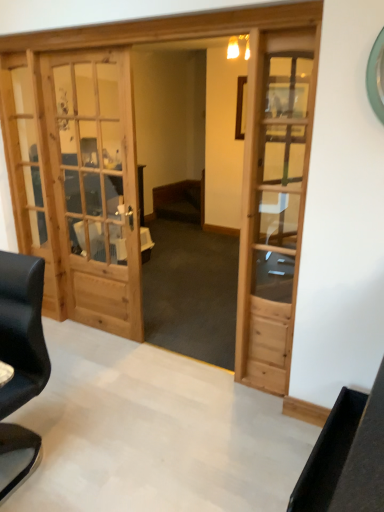
What do you see at coordinates (273, 202) in the screenshot? I see `light brown wooden door at center` at bounding box center [273, 202].

This screenshot has width=384, height=512. What do you see at coordinates (22, 330) in the screenshot?
I see `black leather chair at left` at bounding box center [22, 330].

You are a GUI agent. You are given a task and a screenshot of the screen. Output one action in this format:
    pyautogui.click(x=<x>, y=<y>)
    Task: Click on the wooden table at center
    
    Given the screenshot: What is the action you would take?
    pyautogui.click(x=117, y=246)

Which object is positioned more to the right, wooden table at center or light brown wooden door at center?

light brown wooden door at center is more to the right.

Are wooden table at center and light brown wooden door at center making contact?

No, wooden table at center is not making contact with light brown wooden door at center.

At what (x,y) coordinates should I click in order to perform the action: click on table below the light brown wooden door at center (from a real-world perspective). Please return your answer as a coordinate pair (x, y). This screenshot has height=512, width=384. Looking at the image, I should click on (117, 246).

Which object is further away from the camera, wooden table at center or light brown wooden door at center?

Positioned behind is wooden table at center.

Is black leather chair at left positioned far away from wooden table at center?

black leather chair at left is positioned a significant distance from wooden table at center.

Is wooden table at center surrounded by black leather chair at left?

No, wooden table at center is not surrounded by black leather chair at left.

Considering the positions of point (30, 438) and point (93, 248), is point (30, 438) closer or farther from the camera than point (93, 248)?

Point (30, 438).

From the picture: How many degrees apart are the facing directions of black leather chair at left and wooden table at center?

There is a 0.404-degree angle between the facing directions of black leather chair at left and wooden table at center.

Is light brown wooden door at center positioned with its back to wooden table at center?

No, light brown wooden door at center is not facing the opposite direction of wooden table at center.

Are light brown wooden door at center and wooden table at center beside each other?

No, light brown wooden door at center is not next to wooden table at center.

From a real-world perspective, which is physically above, light brown wooden door at center or wooden table at center?

light brown wooden door at center is physically above.

Does light brown wooden door at center come in front of black leather chair at left?

No, light brown wooden door at center is behind black leather chair at left.

Does point (277, 42) appear closer or farther from the camera than point (35, 315)?

Clearly, point (277, 42) is more distant from the camera than point (35, 315).

Between light brown wooden door at center and black leather chair at left, which one has smaller width?

light brown wooden door at center is thinner.

Does point (12, 399) appear closer or farther from the camera than point (314, 42)?

Point (12, 399) appears to be closer to the viewer than point (314, 42).

From a real-world perspective, which object stands above the other?

light brown wooden door at center.

Is wooden table at center spatially inside black leather chair at left, or outside of it?

wooden table at center is not inside black leather chair at left, it's outside.

From the picture: Which object is closer to the camera taking this photo, wooden table at center or black leather chair at left?

black leather chair at left is closer to the camera.

Where is `table located on the right of black leather chair at left`? The height and width of the screenshot is (512, 384). table located on the right of black leather chair at left is located at coordinates (117, 246).

Can you see wooden table at center touching black leather chair at left?

wooden table at center is not next to black leather chair at left, and they're not touching.

What are the coordinates of `table on the left side of light brown wooden door at center` in the screenshot? It's located at (117, 246).

Identify the location of chair located above the wooden table at center (from a real-world perspective). (22, 330).

Estimate the real-world distances between objects in this image. Which object is closer to black leather chair at left, wooden table at center or light brown wooden door at center?

The object closer to black leather chair at left is light brown wooden door at center.

When comparing their distances from light brown wooden door at center, does black leather chair at left or wooden table at center seem closer?

black leather chair at left is closer to light brown wooden door at center.

Estimate the real-world distances between objects in this image. Which object is further from black leather chair at left, light brown wooden door at center or wooden table at center?

wooden table at center is positioned further to the anchor black leather chair at left.

Estimate the real-world distances between objects in this image. Which object is further from wooden table at center, light brown wooden door at center or black leather chair at left?

Among the two, black leather chair at left is located further to wooden table at center.

When comparing their distances from wooden table at center, does black leather chair at left or light brown wooden door at center seem closer?

light brown wooden door at center is positioned closer to the anchor wooden table at center.

In the scene shown: Estimate the real-world distances between objects in this image. Which object is further from light brown wooden door at center, wooden table at center or black leather chair at left?

wooden table at center.

Identify the location of door between black leather chair at left and wooden table at center from front to back. (273, 202).